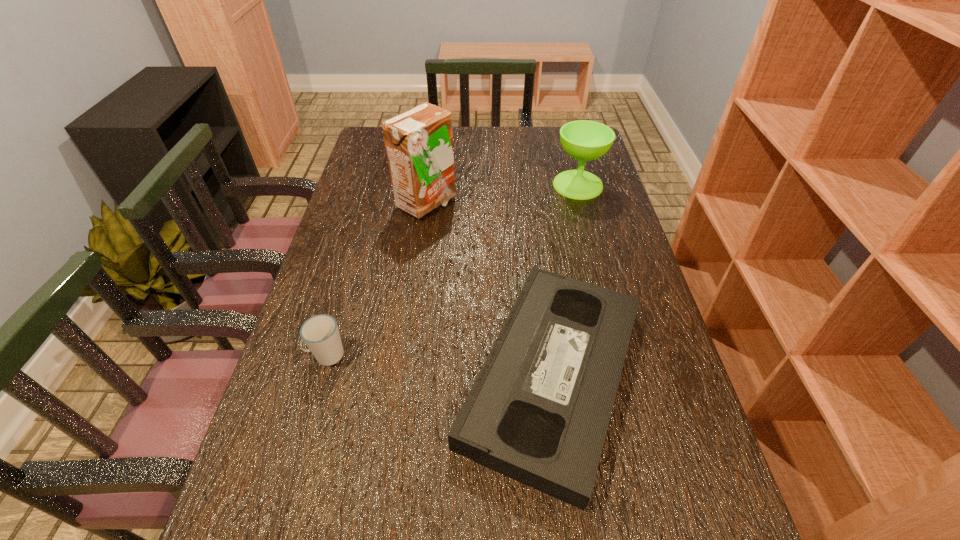
Identify the location of vacant space that's between the shortest object and the second object from left to right. (490, 289).

Where is `free point between the second object from left to right and the second shortest object`? free point between the second object from left to right and the second shortest object is located at coordinates [x=376, y=279].

Find the location of a particular element. blank region between the leftmost object and the videotape is located at coordinates (440, 365).

Identify the location of free space between the third object from right to left and the third tallest object. This screenshot has width=960, height=540. (376, 279).

I want to click on object that is the third closest to the tallest object, so click(x=320, y=333).

Identify which object is the second closest to the videotape. Please provide its 2D coordinates. Your answer should be formatted as a tuple, i.e. [(x, y)], where the tuple contains the x and y coordinates of a point satisfying the conditions above.

[(419, 142)]

This screenshot has width=960, height=540. I want to click on vacant space that satisfies the following two spatial constraints: 1. on the straw side of the tallest object; 2. on the back side of the shortest object, so click(x=402, y=375).